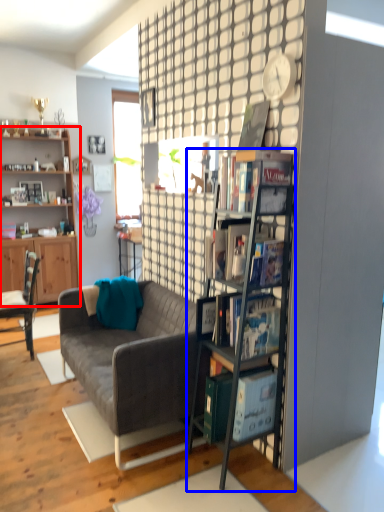
Question: Among these objects, which one is farthest to the camera, shelf (highlighted by a red box) or shelf (highlighted by a blue box)?

Choices:
 (A) shelf
 (B) shelf

Answer: (A)